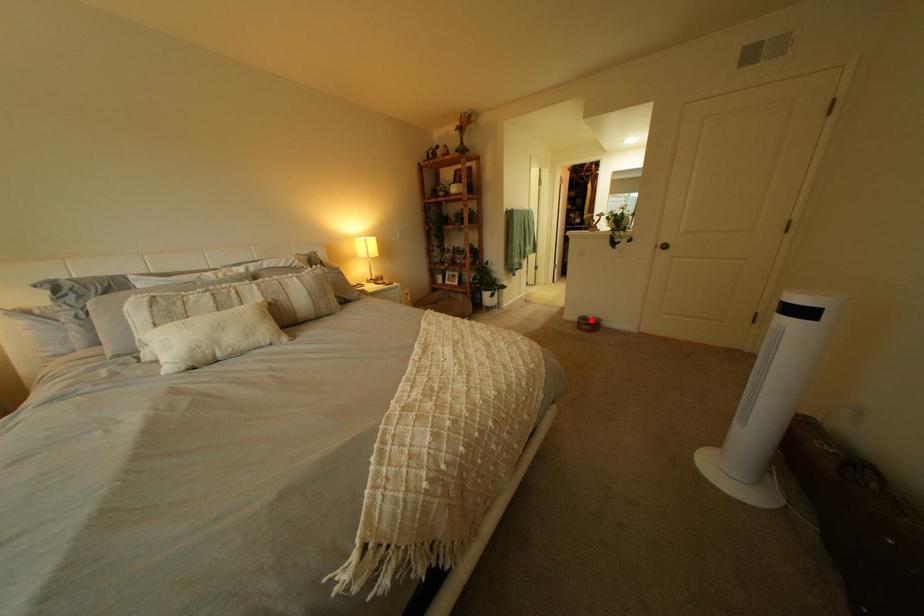
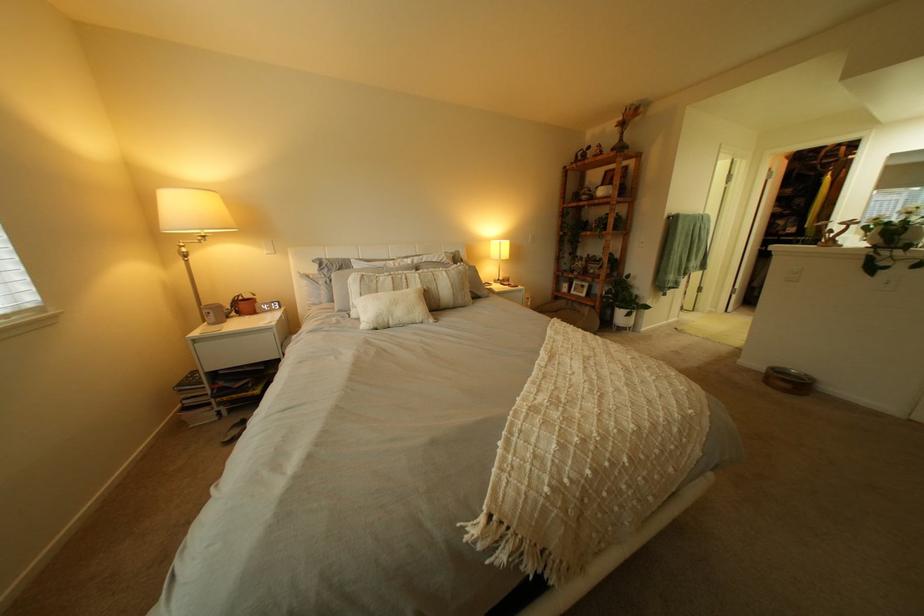
Question: I am providing you with two images of the same scene from different viewpoints. A red point is shown in image1. For the corresponding object point in image2, is it positioned nearer or farther from the camera?

Choices:
 (A) Nearer
 (B) Farther

Answer: (B)